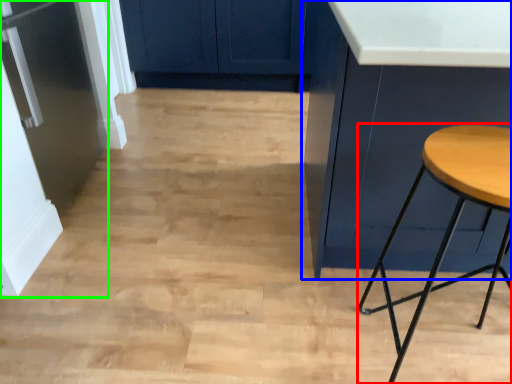
Question: Estimate the real-world distances between objects in this image. Which object is farther from stool (highlighted by a red box), cabinetry (highlighted by a blue box) or fridge (highlighted by a green box)?

Choices:
 (A) cabinetry
 (B) fridge

Answer: (B)